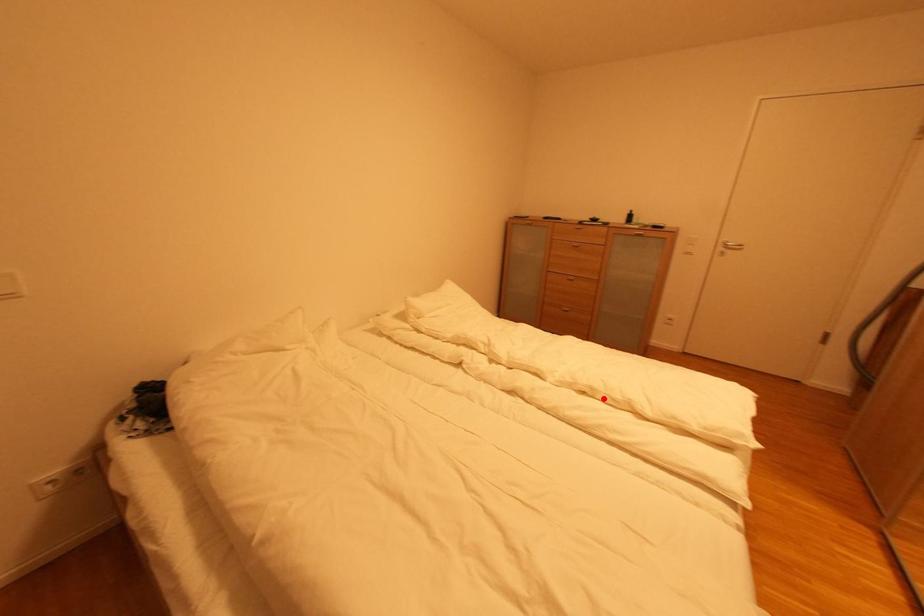
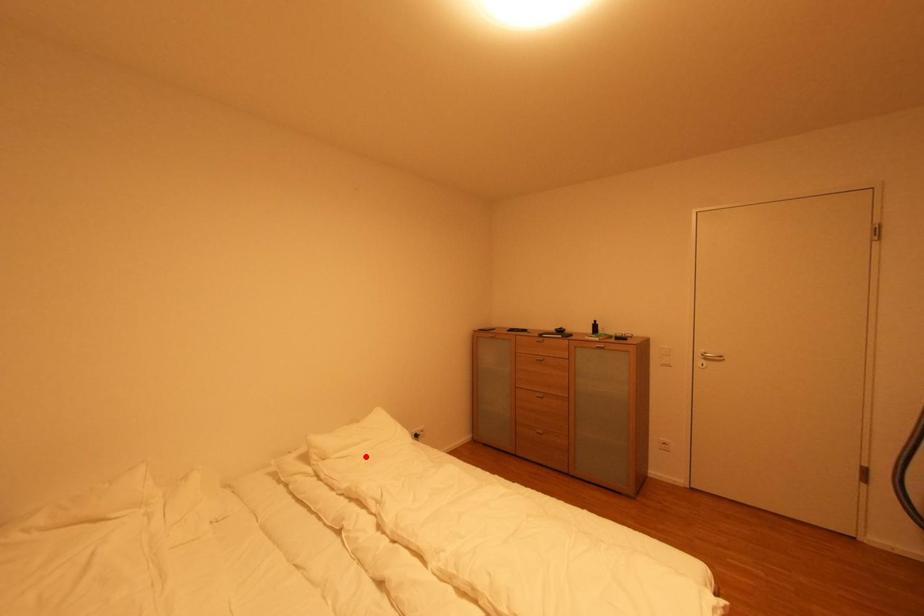
I am providing you with two images of the same scene from different viewpoints. A red point is marked on the first image and another point is marked on the second image. Are the points marked in image1 and image2 representing the same 3D position?

No